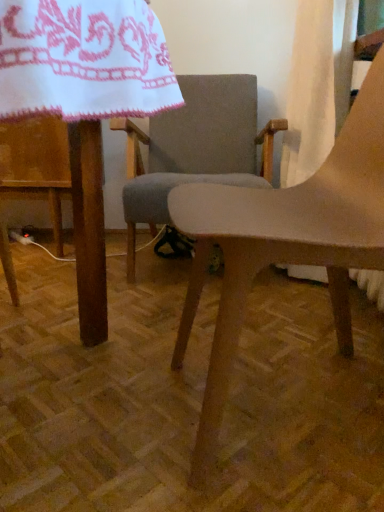
Question: Considering the relative sizes of matte wood chair at center, the second chair viewed from the back, and gray fabric chair at center, positioned as the 2th chair in front-to-back order, in the image provided, is matte wood chair at center, the second chair viewed from the back, wider than gray fabric chair at center, positioned as the 2th chair in front-to-back order,?

Choices:
 (A) yes
 (B) no

Answer: (B)

Question: From the image's perspective, is matte wood chair at center, the 1th chair when ordered from front to back, over gray fabric chair at center, positioned as the 2th chair in front-to-back order?

Choices:
 (A) yes
 (B) no

Answer: (B)

Question: Can we say matte wood chair at center, the second chair viewed from the back, lies outside gray fabric chair at center, which is the 1th chair in back-to-front order?

Choices:
 (A) no
 (B) yes

Answer: (B)

Question: From a real-world perspective, is matte wood chair at center, the second chair viewed from the back, on top of gray fabric chair at center, which is the 1th chair in back-to-front order?

Choices:
 (A) no
 (B) yes

Answer: (B)

Question: Is matte wood chair at center, the 1th chair when ordered from front to back, behind gray fabric chair at center, which is the 1th chair in back-to-front order?

Choices:
 (A) no
 (B) yes

Answer: (A)

Question: From a real-world perspective, is matte wood table at center positioned above or below matte wood chair at center, the second chair viewed from the back?

Choices:
 (A) below
 (B) above

Answer: (A)

Question: Does point (89, 52) appear closer or farther from the camera than point (365, 251)?

Choices:
 (A) closer
 (B) farther

Answer: (A)

Question: Relative to matte wood chair at center, the 1th chair when ordered from front to back, is matte wood table at center in front or behind?

Choices:
 (A) front
 (B) behind

Answer: (A)

Question: From their relative heights in the image, would you say matte wood table at center is taller or shorter than matte wood chair at center, the second chair viewed from the back?

Choices:
 (A) tall
 (B) short

Answer: (B)

Question: Is white fabric curtain at upper right taller or shorter than white embroidered cloth at upper left?

Choices:
 (A) tall
 (B) short

Answer: (A)

Question: In terms of size, does white fabric curtain at upper right appear bigger or smaller than white embroidered cloth at upper left?

Choices:
 (A) big
 (B) small

Answer: (B)

Question: Is white fabric curtain at upper right wider or thinner than white embroidered cloth at upper left?

Choices:
 (A) thin
 (B) wide

Answer: (A)

Question: From a real-world perspective, is white fabric curtain at upper right above or below white embroidered cloth at upper left?

Choices:
 (A) above
 (B) below

Answer: (B)

Question: Is white embroidered cloth at upper left to the left or to the right of matte wood chair at center, the 1th chair when ordered from front to back, in the image?

Choices:
 (A) right
 (B) left

Answer: (B)

Question: From the image's perspective, relative to matte wood chair at center, the 1th chair when ordered from front to back, is white embroidered cloth at upper left above or below?

Choices:
 (A) below
 (B) above

Answer: (B)